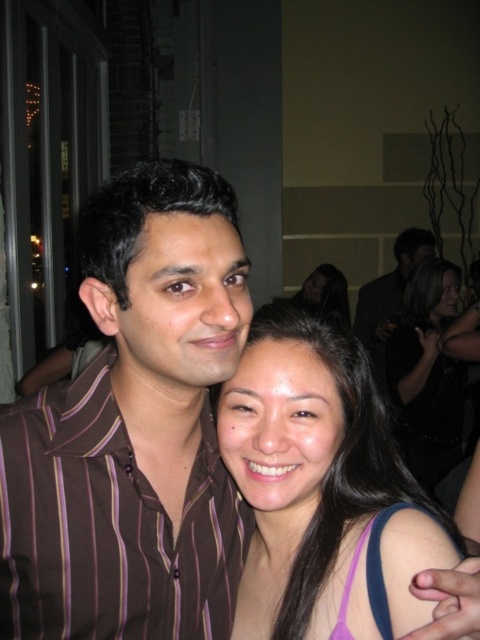
Question: Does black satin dress at lower right appear under smooth black hair at upper right?

Choices:
 (A) no
 (B) yes

Answer: (B)

Question: Where is matte purple tank top at center located in relation to smooth black hair at upper right in the image?

Choices:
 (A) left
 (B) right

Answer: (A)

Question: Which point is closer to the camera?

Choices:
 (A) black satin dress at lower right
 (B) smooth black hair at upper right
 (C) matte purple tank top at center
 (D) dark brown striped shirt at center

Answer: (C)

Question: Among these objects, which one is farthest from the camera?

Choices:
 (A) dark brown striped shirt at center
 (B) black satin dress at lower right
 (C) matte purple tank top at center
 (D) smooth black hair at upper right

Answer: (D)

Question: Is the position of black satin dress at lower right less distant than that of dark brown striped shirt at center?

Choices:
 (A) no
 (B) yes

Answer: (B)

Question: Considering the real-world distances, which object is farthest from the dark brown striped shirt at center?

Choices:
 (A) black satin dress at lower right
 (B) matte purple tank top at center
 (C) brown striped shirt at center
 (D) smooth black hair at upper right

Answer: (C)